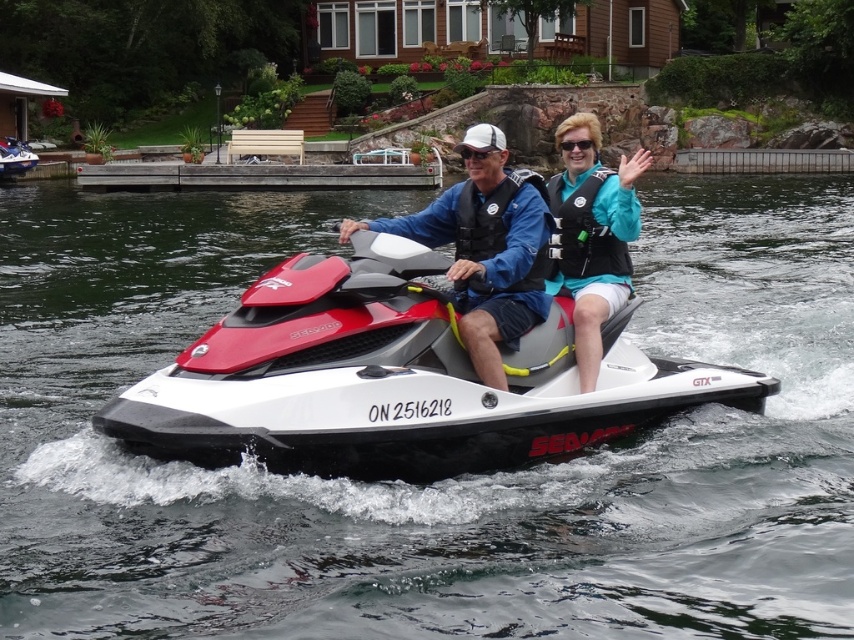
Question: Which point is farther to the camera?

Choices:
 (A) matte black life vest at center
 (B) black matte goggles at center
 (C) teal fabric life vest at upper right

Answer: (B)

Question: Is teal fabric life vest at upper right further to camera compared to teal fabric life jacket at upper right?

Choices:
 (A) yes
 (B) no

Answer: (B)

Question: Is white glossy water at center further to the viewer compared to black fabric life jacket at center?

Choices:
 (A) yes
 (B) no

Answer: (B)

Question: Which point appears closest to the camera in this image?

Choices:
 (A) (463, 218)
 (B) (413, 556)
 (C) (464, 150)

Answer: (B)

Question: Which object is farther from the camera taking this photo?

Choices:
 (A) teal fabric life vest at upper right
 (B) red matte jet ski at center

Answer: (A)

Question: Is the position of white glossy water at center more distant than that of teal fabric life jacket at upper right?

Choices:
 (A) no
 (B) yes

Answer: (A)